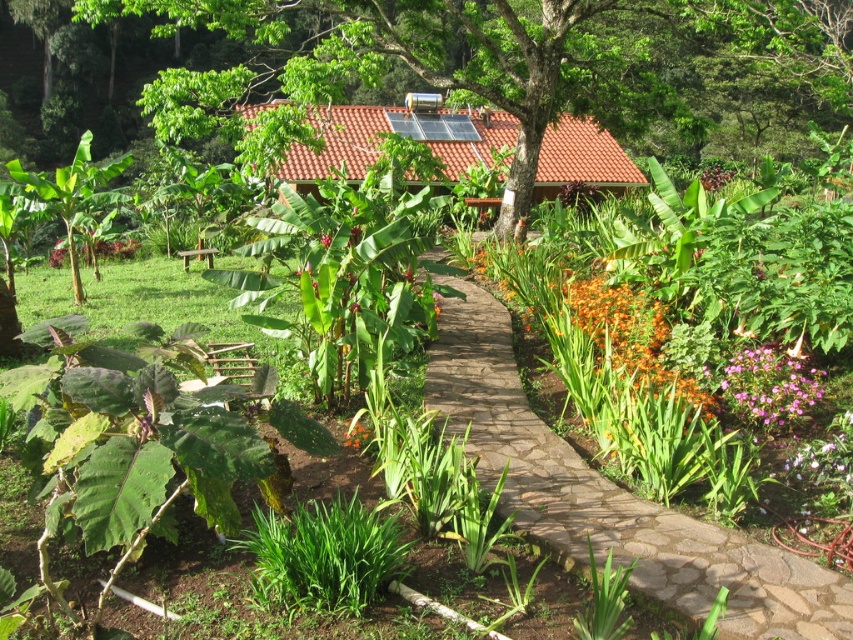
Question: Is brown tile roof at center to the left of pink matte flower at right from the viewer's perspective?

Choices:
 (A) no
 (B) yes

Answer: (B)

Question: Which point is farther to the camera?

Choices:
 (A) (704, 186)
 (B) (809, 561)
 (C) (747, 387)
 (D) (350, 440)

Answer: (A)

Question: Which point appears farthest from the camera in this image?

Choices:
 (A) (708, 186)
 (B) (329, 236)

Answer: (A)

Question: Is pink matte flower at right in front of purple matte flower at upper right?

Choices:
 (A) yes
 (B) no

Answer: (A)

Question: Considering the real-world distances, which object is closest to the pink matte flower at right?

Choices:
 (A) purple matte flower at center
 (B) brown tile roof at center
 (C) brown stone path at center
 (D) purple matte flower at upper right

Answer: (C)

Question: Can you confirm if pink matte flower at right is smaller than purple matte flower at upper right?

Choices:
 (A) no
 (B) yes

Answer: (B)